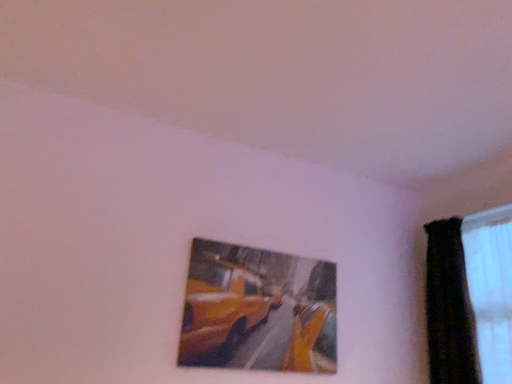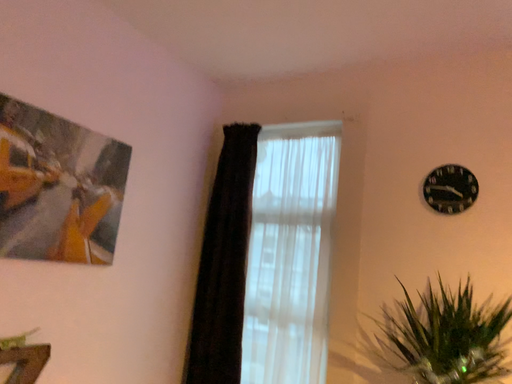
Question: Which way did the camera rotate in the video?

Choices:
 (A) rotated right
 (B) rotated left

Answer: (A)